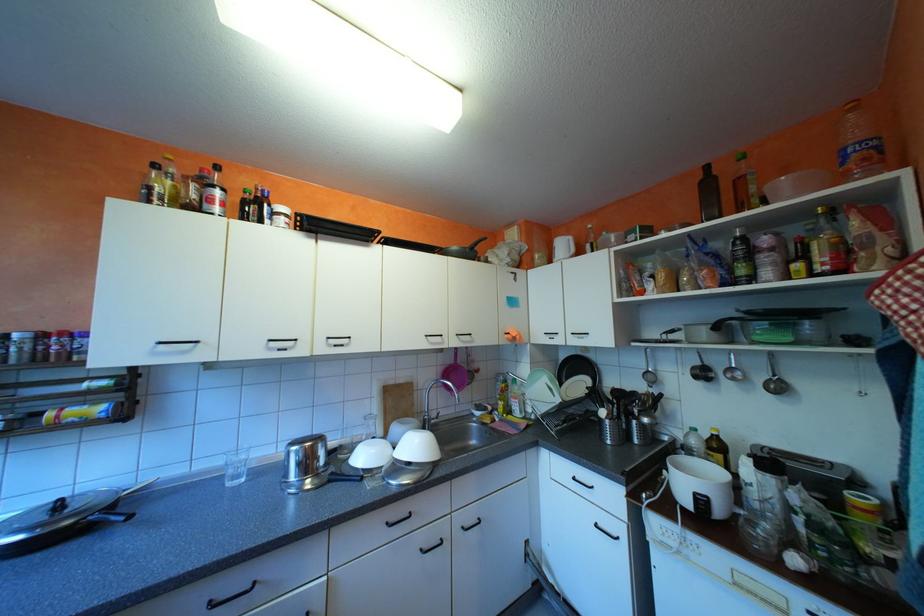
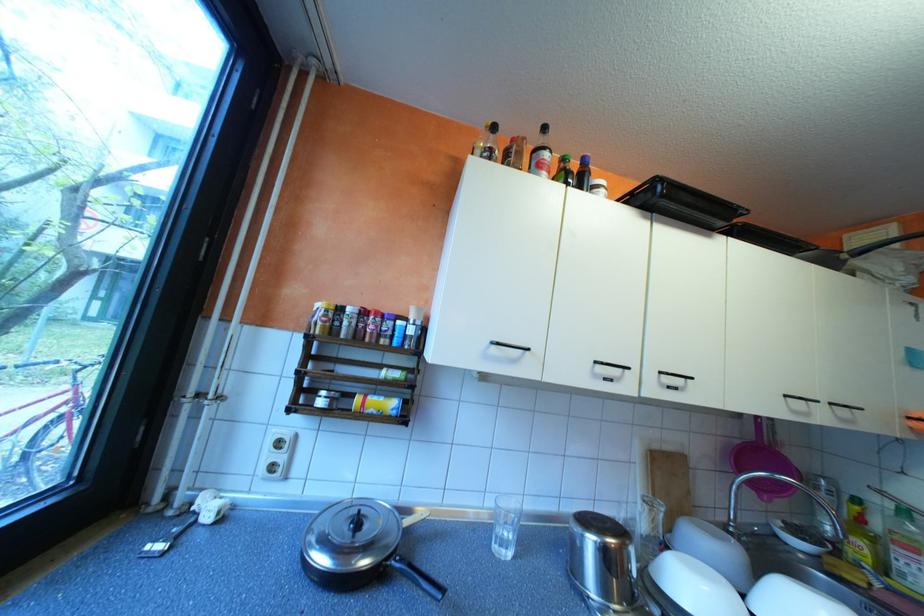
Where in the second image is the point corresponding to point 248,476 from the first image?

(515, 541)